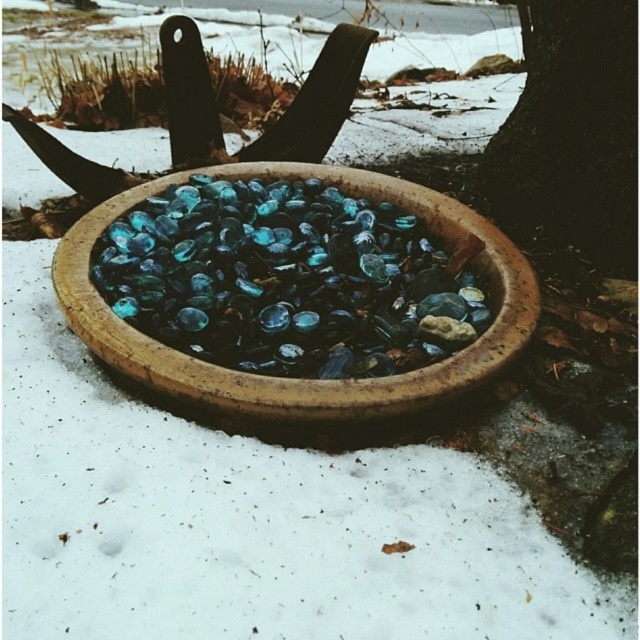
Question: Which point is farther from the camera taking this photo?

Choices:
 (A) click(618, 202)
 (B) click(93, 228)

Answer: (A)

Question: Does translucent glass bowl at center appear on the left side of dark brown textured tree trunk at upper right?

Choices:
 (A) yes
 (B) no

Answer: (A)

Question: Which point appears farthest from the camera in this image?

Choices:
 (A) (576, 83)
 (B) (99, 298)

Answer: (A)

Question: Does translucent glass bowl at center lie in front of dark brown textured tree trunk at upper right?

Choices:
 (A) no
 (B) yes

Answer: (B)

Question: Which point appears closest to the camera in this image?

Choices:
 (A) (534, 188)
 (B) (106, 205)

Answer: (B)

Question: Does translucent glass bowl at center have a larger size compared to dark brown textured tree trunk at upper right?

Choices:
 (A) no
 (B) yes

Answer: (B)